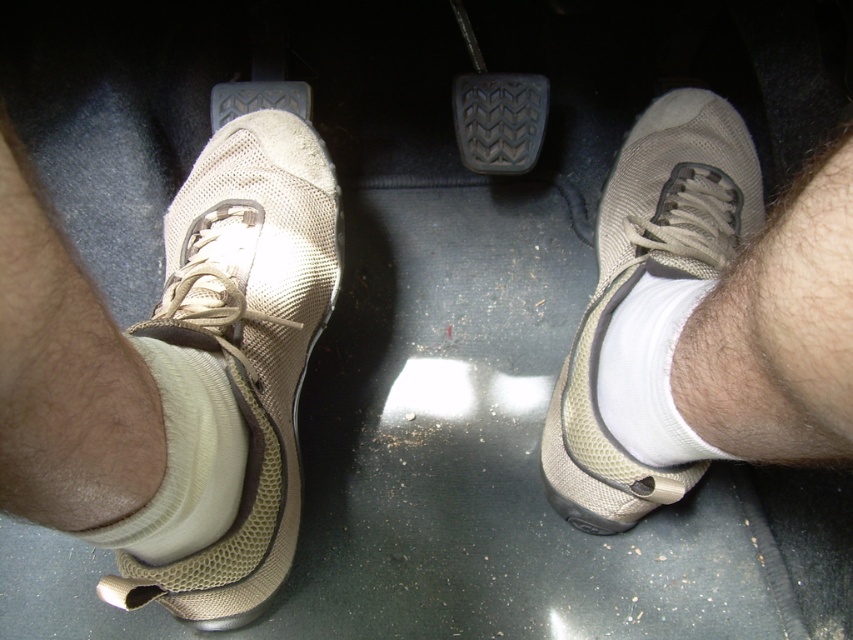
Question: Can you confirm if white fabric sock at lower left is positioned to the right of white soft sock at center?

Choices:
 (A) no
 (B) yes

Answer: (A)

Question: Which of these objects is positioned farthest from the white fabric sock at lower left?

Choices:
 (A) tan mesh shoe at left
 (B) white soft sock at center

Answer: (B)

Question: Which object is the farthest from the tan mesh shoe at center?

Choices:
 (A) tan mesh shoe at left
 (B) white soft sock at center

Answer: (A)

Question: Can you confirm if tan mesh shoe at center is positioned below white fabric sock at lower left?

Choices:
 (A) no
 (B) yes

Answer: (A)

Question: Which point is closer to the camera?

Choices:
 (A) tan mesh shoe at left
 (B) white fabric sock at lower left

Answer: (B)

Question: Does tan mesh shoe at left have a smaller size compared to white fabric sock at lower left?

Choices:
 (A) yes
 (B) no

Answer: (B)